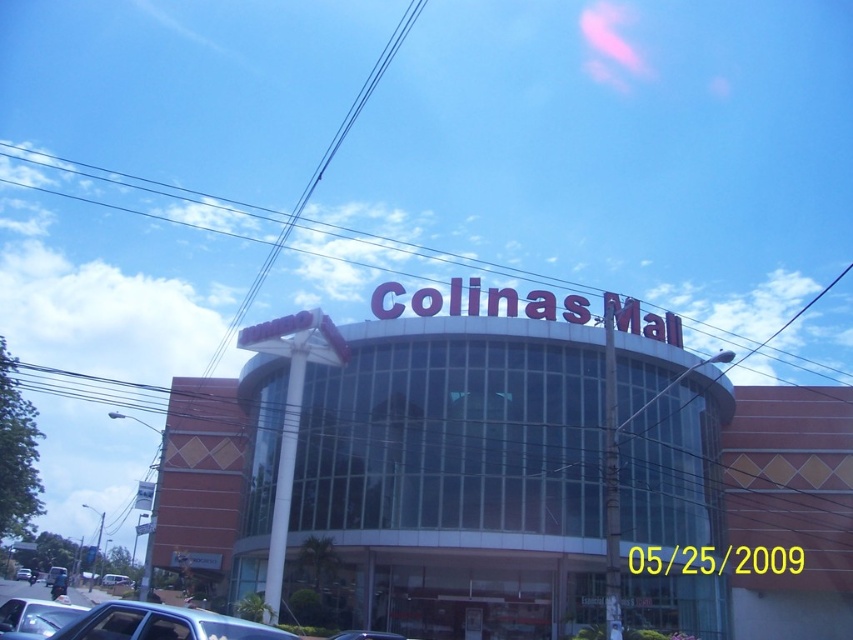
You are a delivery person trying to park your 1.8 meters wide van in the Colinas Mall parking lot. You see a metallic blue sedan at lower left and a metallic silver car at center. Can you fit your van between them?

The metallic blue sedan at lower left might be wider than metallic silver car at center. Since the width of the metallic blue sedan at lower left is uncertain, it is possible that the space between them is narrower than 1.8 meters. Therefore, it is not advisable to attempt parking the van between them without knowing the exact widths.

You are standing at the entrance of Colinas Mall and notice a point marked at coordinates [512,480]. Which object in the scene does this point most likely represent?

The point at coordinates [512,480] corresponds to the orange glass building at center.